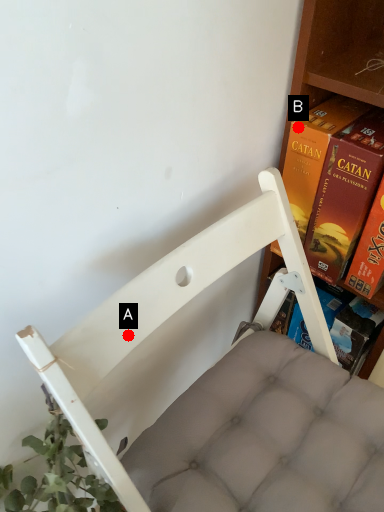
Question: Two points are circled on the image, labeled by A and B beside each circle. Which point is farther from the camera taking this photo?

Choices:
 (A) A is further
 (B) B is further

Answer: (B)